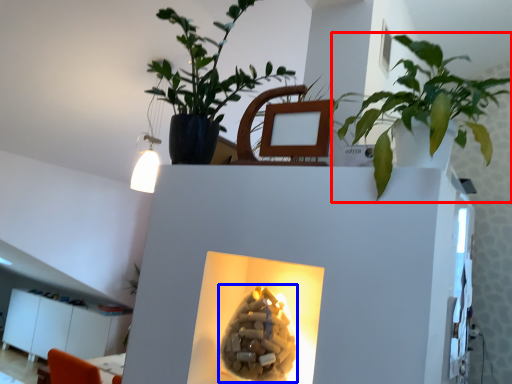
Question: Which object is further to the camera taking this photo, houseplant (highlighted by a red box) or flower (highlighted by a blue box)?

Choices:
 (A) houseplant
 (B) flower

Answer: (B)